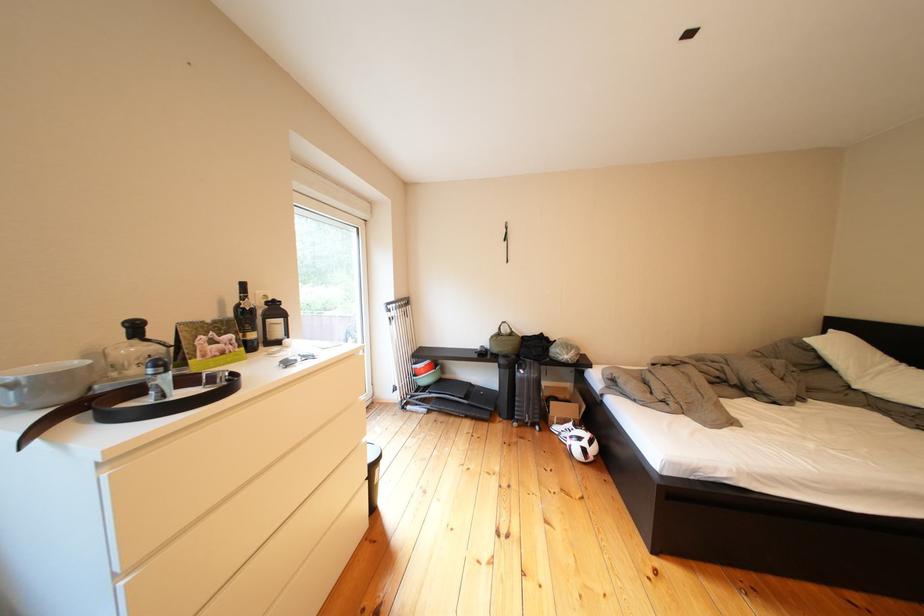
Describe the element at coordinates (246, 318) in the screenshot. I see `the dark wine bottle` at that location.